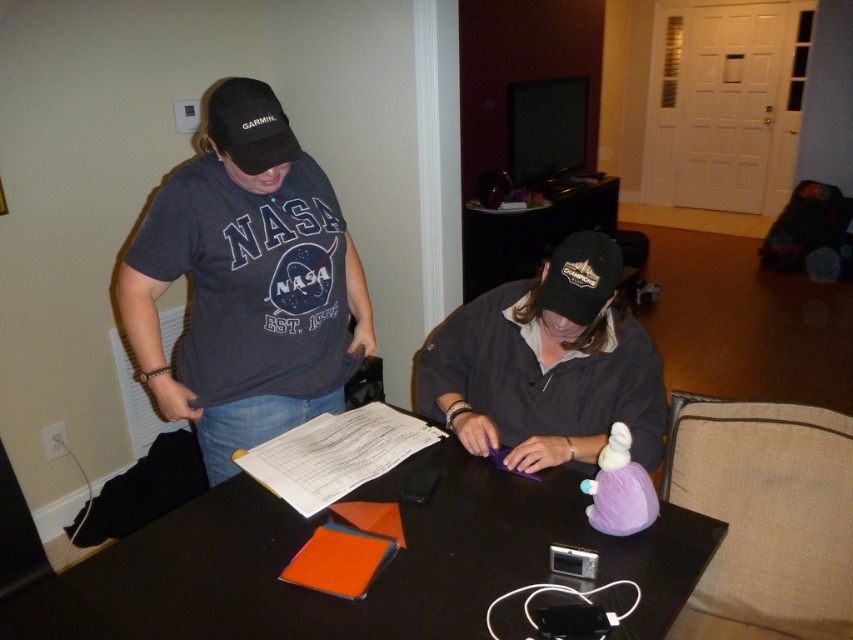
Which is more to the left, matte black t-shirt at left or black fabric baseball cap at upper left?

matte black t-shirt at left

Between point (227, 419) and point (257, 122), which one is positioned behind?

Point (227, 419)

The width and height of the screenshot is (853, 640). In order to click on matte black t-shirt at left in this screenshot , I will do `click(247, 282)`.

Does black matte cap at center have a greater height compared to black fabric baseball cap at upper left?

Yes, black matte cap at center is taller than black fabric baseball cap at upper left.

Between point (645, 355) and point (230, 148), which one is positioned behind?

The point (645, 355) is more distant.

Is point (503, 368) in front of point (242, 145)?

No.

The image size is (853, 640). I want to click on black matte cap at center, so click(547, 365).

Is matte black t-shirt at left closer to camera compared to black fabric baseball cap at center?

Yes, it is.

Between point (169, 243) and point (556, 272), which one is positioned in front?

Positioned in front is point (556, 272).

At what (x,y) coordinates should I click in order to perform the action: click on matte black t-shirt at left. Please return your answer as a coordinate pair (x, y). The image size is (853, 640). Looking at the image, I should click on (247, 282).